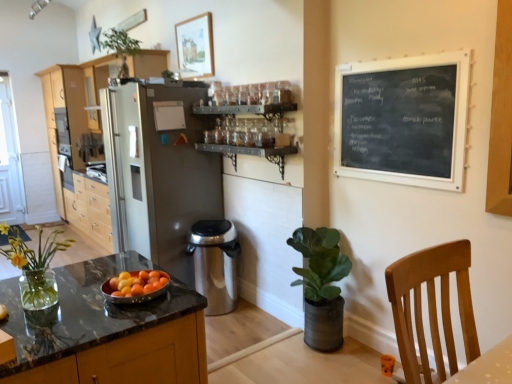
Where is `free spot above black chalkboard at upper right (from a real-world perspective)`? This screenshot has height=384, width=512. free spot above black chalkboard at upper right (from a real-world perspective) is located at coordinates (397, 56).